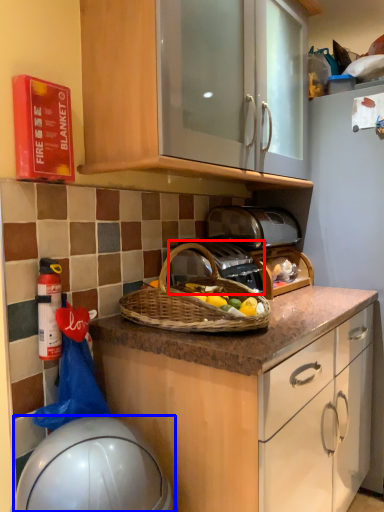
Question: Which point is closer to the camera, gas stove (highlighted by a red box) or appliance (highlighted by a blue box)?

Choices:
 (A) gas stove
 (B) appliance

Answer: (B)